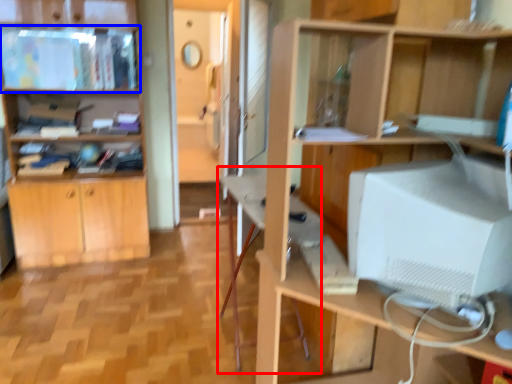
Question: Which point is closer to the camera, computer desk (highlighted by a red box) or cabinet (highlighted by a blue box)?

Choices:
 (A) computer desk
 (B) cabinet

Answer: (A)